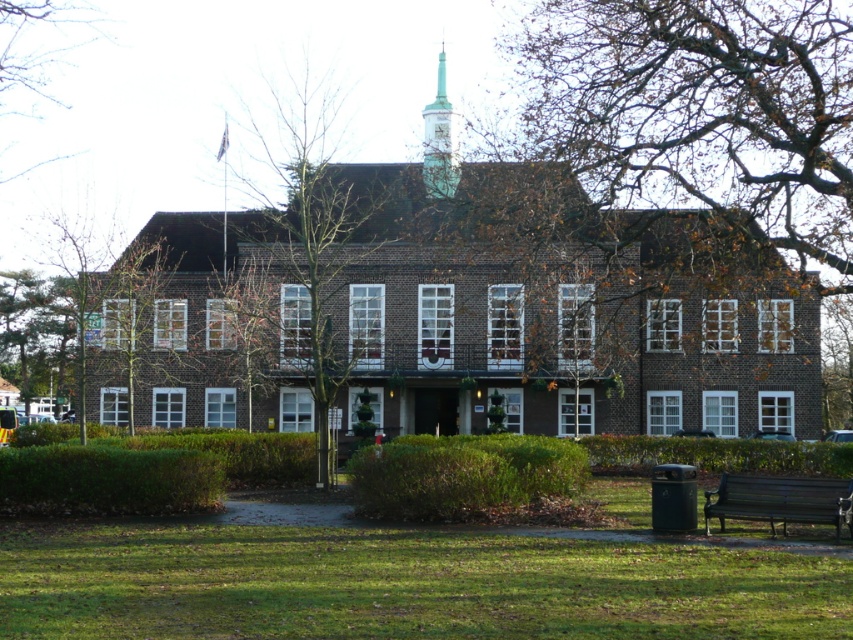
Question: In this image, where is green leafy tree at left located relative to green leafy hedge at lower left?

Choices:
 (A) right
 (B) left

Answer: (B)

Question: Which point is farther from the camera taking this photo?

Choices:
 (A) (128, 333)
 (B) (218, 484)
 (C) (428, 435)

Answer: (A)

Question: Is green leafy hedge at lower left positioned before green leafy hedge at lower right?

Choices:
 (A) yes
 (B) no

Answer: (A)

Question: Which point is farther to the camera?

Choices:
 (A) (798, 490)
 (B) (39, 454)
 (C) (305, 198)

Answer: (C)

Question: Which point is closer to the camera?

Choices:
 (A) green leafy hedge at center
 (B) dark brown wooden bench at lower right

Answer: (B)

Question: Can you confirm if brown brick church at center is thinner than green leafy hedge at lower left?

Choices:
 (A) no
 (B) yes

Answer: (A)